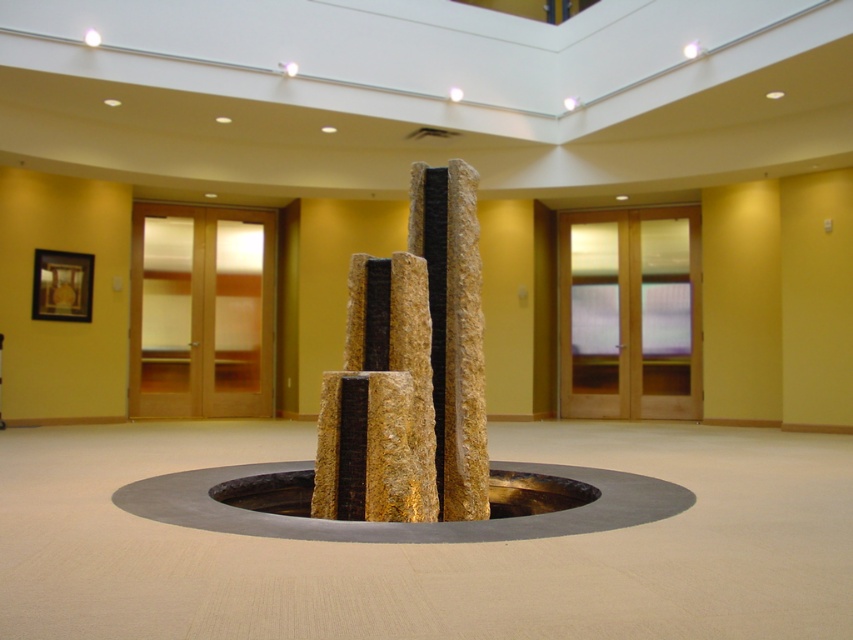
Does rusty metal manhole at center have a larger size compared to metallic circular manhole at center?

No.

The image size is (853, 640). What do you see at coordinates (534, 493) in the screenshot?
I see `rusty metal manhole at center` at bounding box center [534, 493].

What do you see at coordinates (534, 493) in the screenshot? I see `rusty metal manhole at center` at bounding box center [534, 493].

Where is `rusty metal manhole at center`? The width and height of the screenshot is (853, 640). rusty metal manhole at center is located at coordinates (534, 493).

Does golden textured stone at center have a greater width compared to rusty metal manhole at center?

Indeed, golden textured stone at center has a greater width compared to rusty metal manhole at center.

What are the coordinates of `golden textured stone at center` in the screenshot? It's located at (413, 362).

Does golden textured stone at center have a larger size compared to metallic circular manhole at center?

Indeed, golden textured stone at center has a larger size compared to metallic circular manhole at center.

Can you confirm if golden textured stone at center is positioned above metallic circular manhole at center?

Yes, golden textured stone at center is above metallic circular manhole at center.

At what (x,y) coordinates should I click in order to perform the action: click on golden textured stone at center. Please return your answer as a coordinate pair (x, y). This screenshot has width=853, height=640. Looking at the image, I should click on click(x=413, y=362).